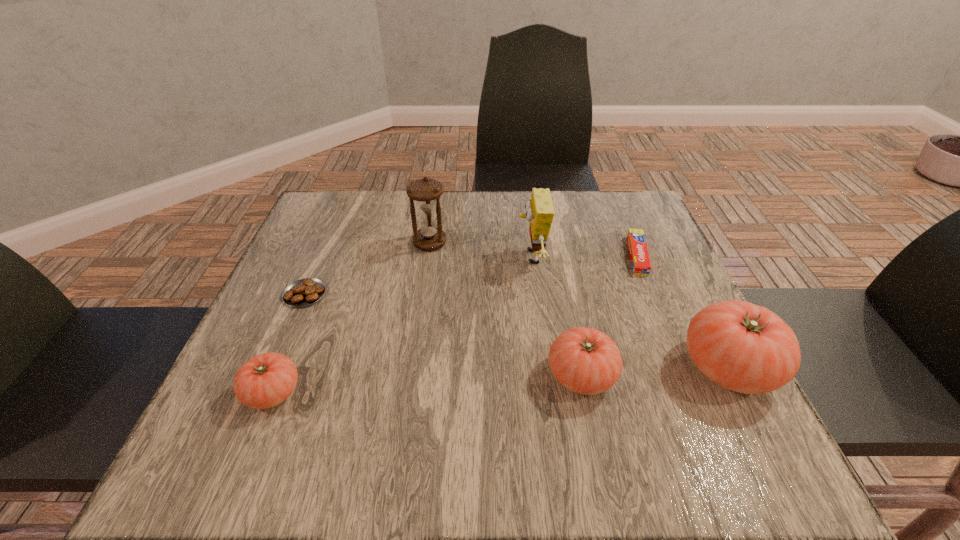
Locate an element on the screen. This screenshot has width=960, height=540. the shortest tomato is located at coordinates (266, 380).

Where is `the third shortest object`? the third shortest object is located at coordinates (266, 380).

This screenshot has height=540, width=960. What are the coordinates of `the second shortest tomato` in the screenshot? It's located at (586, 361).

This screenshot has height=540, width=960. What are the coordinates of `the fourth shortest object` in the screenshot? It's located at (586, 361).

Locate an element on the screen. the rightmost tomato is located at coordinates (743, 347).

At what (x,y) coordinates should I click in order to perform the action: click on the tallest tomato. Please return your answer as a coordinate pair (x, y). The width and height of the screenshot is (960, 540). Looking at the image, I should click on (743, 347).

This screenshot has width=960, height=540. I want to click on toothpaste, so click(x=639, y=256).

The width and height of the screenshot is (960, 540). Identify the location of sponge. (540, 212).

Locate an element on the screen. The image size is (960, 540). pastry is located at coordinates click(303, 292).

At what (x,y) coordinates should I click in order to perform the action: click on hourglass. Please return your answer as a coordinate pair (x, y). This screenshot has height=540, width=960. Looking at the image, I should click on (426, 192).